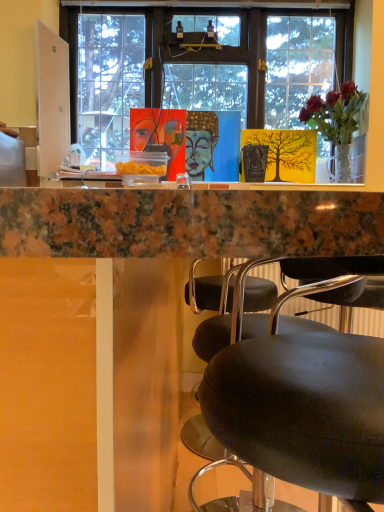
Question: In terms of height, does translucent glass vase at upper right look taller or shorter compared to marble countertop at upper center?

Choices:
 (A) tall
 (B) short

Answer: (B)

Question: Is translucent glass vase at upper right in front of or behind marble countertop at upper center in the image?

Choices:
 (A) behind
 (B) front

Answer: (A)

Question: From the image's perspective, relative to marble countertop at upper center, is translucent glass vase at upper right above or below?

Choices:
 (A) above
 (B) below

Answer: (A)

Question: Is point (99, 219) closer or farther from the camera than point (316, 114)?

Choices:
 (A) farther
 (B) closer

Answer: (B)

Question: In the image, is marble countertop at upper center positioned in front of or behind translucent glass vase at upper right?

Choices:
 (A) front
 (B) behind

Answer: (A)

Question: Do you think marble countertop at upper center is within translucent glass vase at upper right, or outside of it?

Choices:
 (A) inside
 (B) outside

Answer: (B)

Question: From the image's perspective, is marble countertop at upper center positioned above or below translucent glass vase at upper right?

Choices:
 (A) below
 (B) above

Answer: (A)